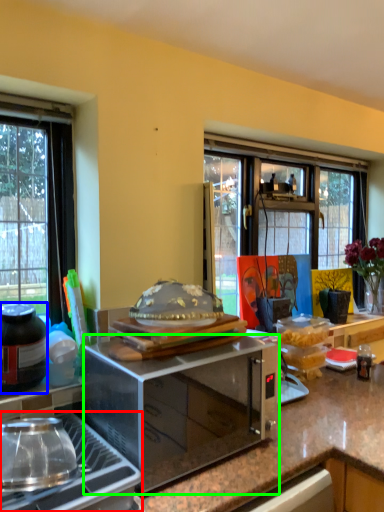
Question: Which is farther away from gas stove (highlighted by a red box)? bottle (highlighted by a blue box) or microwave oven (highlighted by a green box)?

Choices:
 (A) bottle
 (B) microwave oven

Answer: (A)